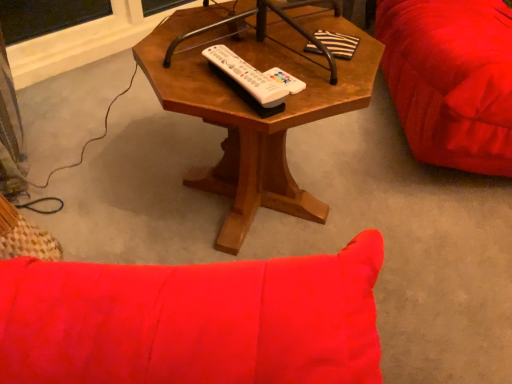
The image size is (512, 384). Find the location of `vacant space to the left of wooden hexagonal table at center`. vacant space to the left of wooden hexagonal table at center is located at coordinates (112, 167).